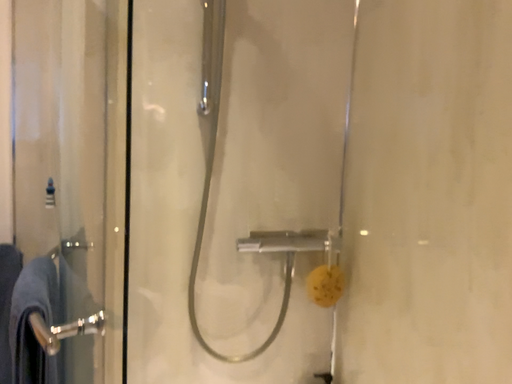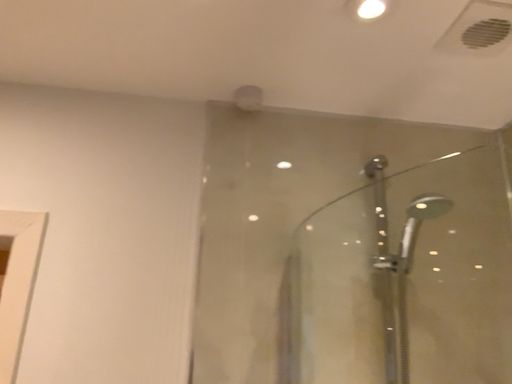
Question: Which way did the camera rotate in the video?

Choices:
 (A) rotated downward
 (B) rotated upward

Answer: (B)